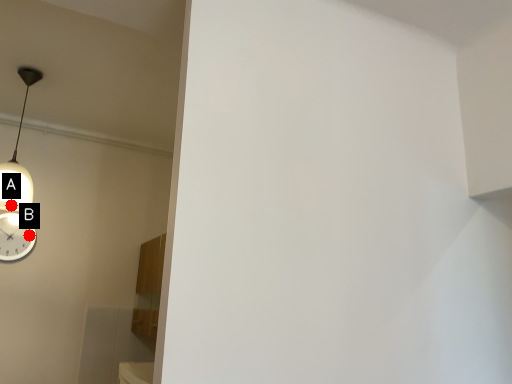
Question: Two points are circled on the image, labeled by A and B beside each circle. Among these points, which one is nearest to the camera?

Choices:
 (A) A is closer
 (B) B is closer

Answer: (A)